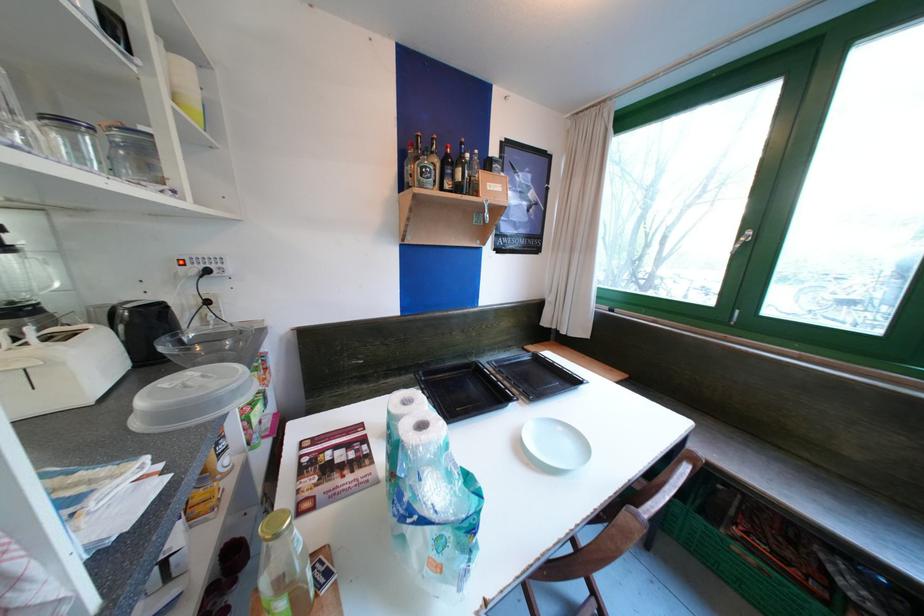
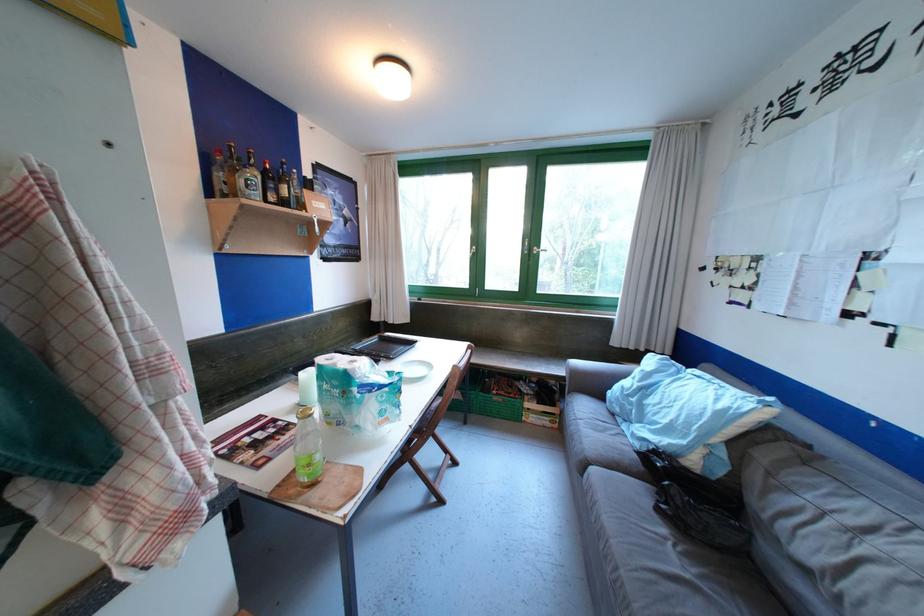
The point at (771, 549) is marked in the first image. Where is the corresponding point in the second image?

(509, 394)